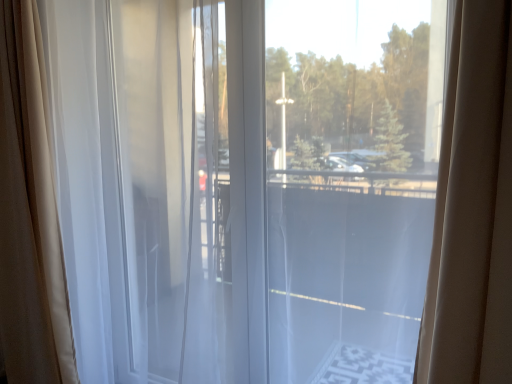
Question: Is white sheer curtain at left, which appears as the first curtain when viewed from the right, outside of sheer white curtain at left, which ranks as the 1th curtain in left-to-right order?

Choices:
 (A) yes
 (B) no

Answer: (A)

Question: Can you confirm if white sheer curtain at left, which appears as the first curtain when viewed from the right, is bigger than sheer white curtain at left, arranged as the 2th curtain when viewed from the right?

Choices:
 (A) yes
 (B) no

Answer: (A)

Question: From the image's perspective, would you say white sheer curtain at left, the second curtain from the left, is positioned over sheer white curtain at left, which ranks as the 1th curtain in left-to-right order?

Choices:
 (A) yes
 (B) no

Answer: (B)

Question: Is white sheer curtain at left, the second curtain from the left, positioned with its back to sheer white curtain at left, arranged as the 2th curtain when viewed from the right?

Choices:
 (A) no
 (B) yes

Answer: (A)

Question: From a real-world perspective, is white sheer curtain at left, the second curtain from the left, positioned over sheer white curtain at left, which ranks as the 1th curtain in left-to-right order, based on gravity?

Choices:
 (A) yes
 (B) no

Answer: (A)

Question: From a real-world perspective, is sheer white curtain at left, which ranks as the 1th curtain in left-to-right order, above or below white sheer curtain at left, which appears as the first curtain when viewed from the right?

Choices:
 (A) below
 (B) above

Answer: (A)

Question: Do you think sheer white curtain at left, arranged as the 2th curtain when viewed from the right, is within white sheer curtain at left, which appears as the first curtain when viewed from the right, or outside of it?

Choices:
 (A) inside
 (B) outside

Answer: (B)

Question: Considering the positions of sheer white curtain at left, arranged as the 2th curtain when viewed from the right, and white sheer curtain at left, the second curtain from the left, in the image, is sheer white curtain at left, arranged as the 2th curtain when viewed from the right, wider or thinner than white sheer curtain at left, the second curtain from the left,?

Choices:
 (A) thin
 (B) wide

Answer: (B)

Question: Relative to white sheer curtain at left, which appears as the first curtain when viewed from the right, is sheer white curtain at left, which ranks as the 1th curtain in left-to-right order, in front or behind?

Choices:
 (A) front
 (B) behind

Answer: (B)

Question: In terms of width, does transparent glass window at center look wider or thinner when compared to white sheer curtain at left, the second curtain from the left?

Choices:
 (A) thin
 (B) wide

Answer: (B)

Question: From a real-world perspective, is transparent glass window at center positioned above or below white sheer curtain at left, which appears as the first curtain when viewed from the right?

Choices:
 (A) above
 (B) below

Answer: (A)

Question: Is transparent glass window at center bigger or smaller than white sheer curtain at left, the second curtain from the left?

Choices:
 (A) small
 (B) big

Answer: (A)

Question: From the image's perspective, is transparent glass window at center above or below white sheer curtain at left, the second curtain from the left?

Choices:
 (A) above
 (B) below

Answer: (A)

Question: Is sheer white curtain at left, which ranks as the 1th curtain in left-to-right order, to the left or to the right of transparent glass window at center in the image?

Choices:
 (A) right
 (B) left

Answer: (B)

Question: Is point (19, 362) positioned closer to the camera than point (330, 193)?

Choices:
 (A) closer
 (B) farther

Answer: (B)